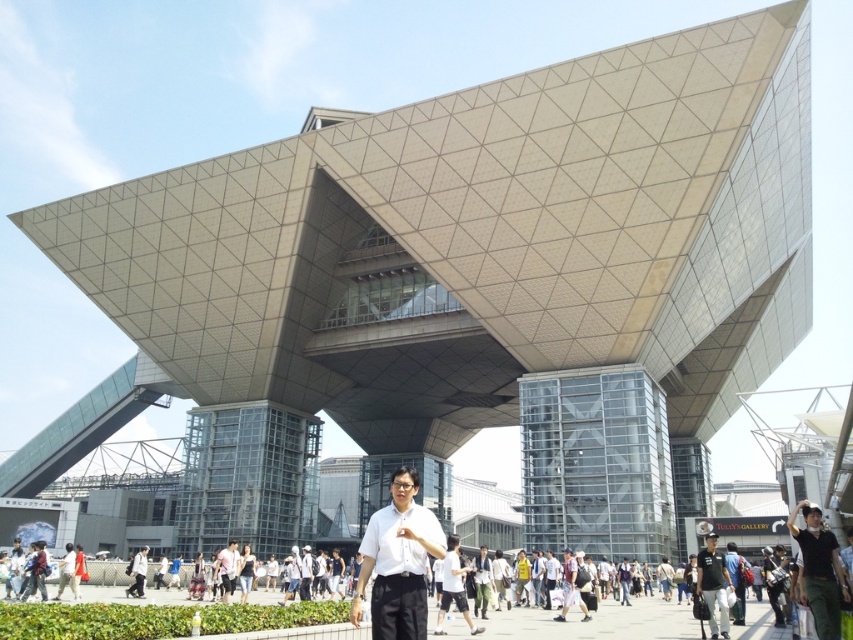
You are a photographer trying to capture a candid shot of the tourists near the modern building. You notice the white matte shirt at center and the green fabric pants at lower right. Which clothing item appears bigger in your photo?

The white matte shirt at center appears bigger in the photo because it is larger in size than the green fabric pants at lower right.

You are a photographer trying to capture a candid shot of the tourists in front of the modern building. You notice the green fabric pants at lower right and the black cotton shirt at center. Which of these two items would be harder to include fully in your photo frame if you focus on the center area?

The green fabric pants at lower right would be harder to include fully in your photo frame because it occupies less space than the black cotton shirt at center, making it more likely to be partially outside the frame when focusing on the center area.